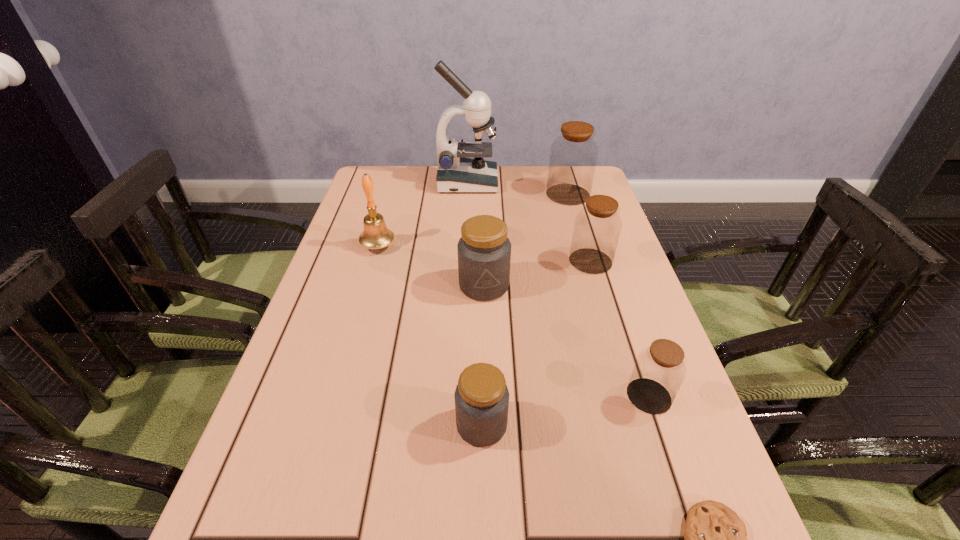
Where is `vacant space located on the left of the tallest jar`? The height and width of the screenshot is (540, 960). vacant space located on the left of the tallest jar is located at coordinates (518, 194).

At what (x,y) coordinates should I click in order to perform the action: click on vacant space positioned on the front of the bell. Please return your answer as a coordinate pair (x, y). This screenshot has width=960, height=540. Looking at the image, I should click on (367, 287).

Find the location of a particular element. This screenshot has height=540, width=960. vacant space located on the left of the second nearest brown jar is located at coordinates (483, 261).

The height and width of the screenshot is (540, 960). I want to click on vacant area located 0.250m on the surface of the farther gray jar near the warning symbol, so pos(485,392).

Where is `free space located on the surface of the smaller gray jar near the warning symbol`? free space located on the surface of the smaller gray jar near the warning symbol is located at coordinates (402, 424).

This screenshot has height=540, width=960. I want to click on free spot located on the surface of the smaller gray jar near the warning symbol, so click(396, 424).

The width and height of the screenshot is (960, 540). Identify the location of vacant area situated on the surface of the smaller gray jar near the warning symbol. (413, 424).

Find the location of a particular element. The width and height of the screenshot is (960, 540). vacant space positioned on the left of the nearest brown jar is located at coordinates (535, 396).

You are a GUI agent. You are given a task and a screenshot of the screen. Output one action in this format:
    pyautogui.click(x=<x>, y=<y>)
    Task: Click on the microscope that is positioned at the far edge
    This screenshot has height=540, width=960.
    Given the screenshot: What is the action you would take?
    pyautogui.click(x=456, y=174)

You are a GUI agent. You are given a task and a screenshot of the screen. Output one action in this format:
    pyautogui.click(x=<x>, y=<y>)
    Task: Click on the jar present at the far edge
    This screenshot has height=540, width=960.
    Given the screenshot: What is the action you would take?
    pyautogui.click(x=573, y=156)